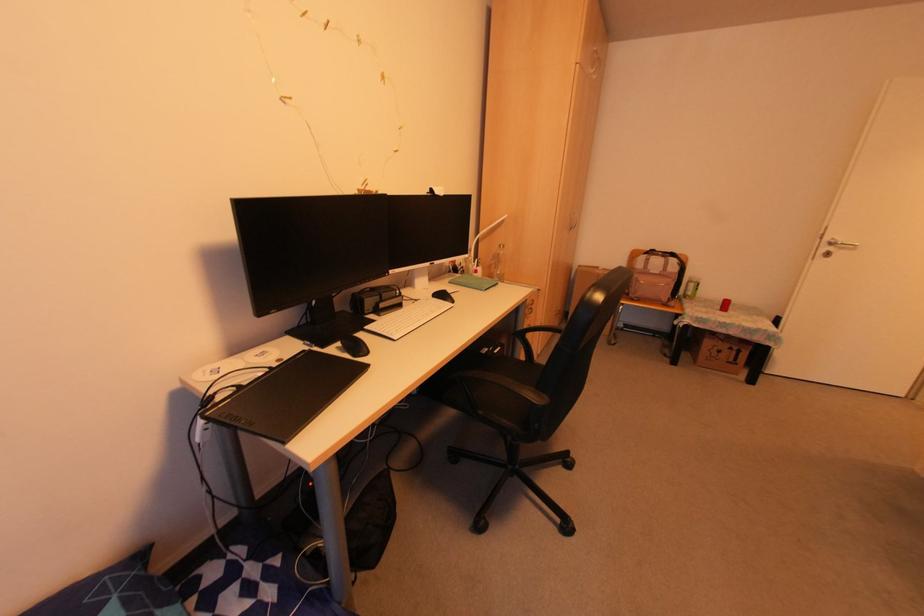
This screenshot has width=924, height=616. Find the location of `silver door handle`. silver door handle is located at coordinates (833, 246).